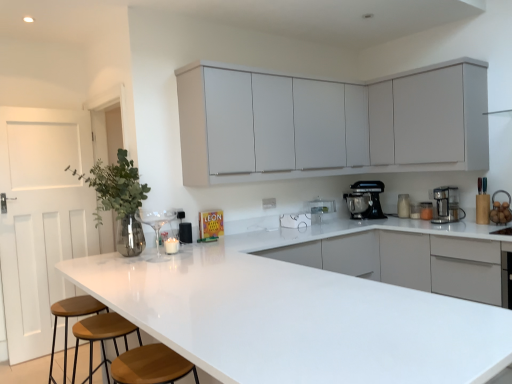
Question: Is the depth of white glossy countertop at center greater than that of brown leather stool at lower left, which is counted as the first bar stool, starting from the back?

Choices:
 (A) yes
 (B) no

Answer: (B)

Question: Is white glossy countertop at center directly adjacent to brown leather stool at lower left, which is counted as the first bar stool, starting from the back?

Choices:
 (A) no
 (B) yes

Answer: (A)

Question: Would you say white glossy countertop at center is a long distance from brown leather stool at lower left, which is counted as the first bar stool, starting from the back?

Choices:
 (A) yes
 (B) no

Answer: (A)

Question: Would you say white glossy countertop at center is outside brown leather stool at lower left, which is counted as the first bar stool, starting from the back?

Choices:
 (A) no
 (B) yes

Answer: (B)

Question: Does white glossy countertop at center have a larger size compared to brown leather stool at lower left, acting as the 2th bar stool starting from the front?

Choices:
 (A) no
 (B) yes

Answer: (B)

Question: Is brown wooden stool at lower left, positioned as the second bar stool in back-to-front order, to the left or to the right of white matte cabinet at upper right, the first cabinetry viewed from the right, in the image?

Choices:
 (A) left
 (B) right

Answer: (A)

Question: From the image's perspective, is brown wooden stool at lower left, positioned as the second bar stool in back-to-front order, above or below white matte cabinet at upper right, the 2th cabinetry viewed from the left?

Choices:
 (A) below
 (B) above

Answer: (A)

Question: In terms of width, does brown wooden stool at lower left, the 1th bar stool positioned from the front, look wider or thinner when compared to white matte cabinet at upper right, the first cabinetry viewed from the right?

Choices:
 (A) thin
 (B) wide

Answer: (B)

Question: Is brown wooden stool at lower left, the 1th bar stool positioned from the front, in front of or behind white matte cabinet at upper right, the first cabinetry viewed from the right, in the image?

Choices:
 (A) behind
 (B) front

Answer: (B)

Question: Considering their positions, is matte black coffee maker at right, which ranks as the first appliance in front-to-back order, located in front of or behind brown wooden stool at lower left, positioned as the second bar stool in back-to-front order?

Choices:
 (A) behind
 (B) front

Answer: (A)

Question: Based on their sizes in the image, would you say matte black coffee maker at right, the first appliance when ordered from right to left, is bigger or smaller than brown wooden stool at lower left, the 1th bar stool positioned from the front?

Choices:
 (A) big
 (B) small

Answer: (B)

Question: Based on their positions, is matte black coffee maker at right, which ranks as the second appliance in back-to-front order, located to the left or right of brown wooden stool at lower left, the 1th bar stool positioned from the front?

Choices:
 (A) right
 (B) left

Answer: (A)

Question: Do you think matte black coffee maker at right, which ranks as the 2th appliance in left-to-right order, is within brown wooden stool at lower left, the 1th bar stool positioned from the front, or outside of it?

Choices:
 (A) outside
 (B) inside

Answer: (A)

Question: Considering the positions of point (65, 377) and point (388, 145), is point (65, 377) closer or farther from the camera than point (388, 145)?

Choices:
 (A) farther
 (B) closer

Answer: (B)

Question: Which is correct: brown leather stool at lower left, which is counted as the first bar stool, starting from the back, is inside white matte cabinet at upper center, marked as the second cabinetry in a right-to-left arrangement, or outside of it?

Choices:
 (A) outside
 (B) inside

Answer: (A)